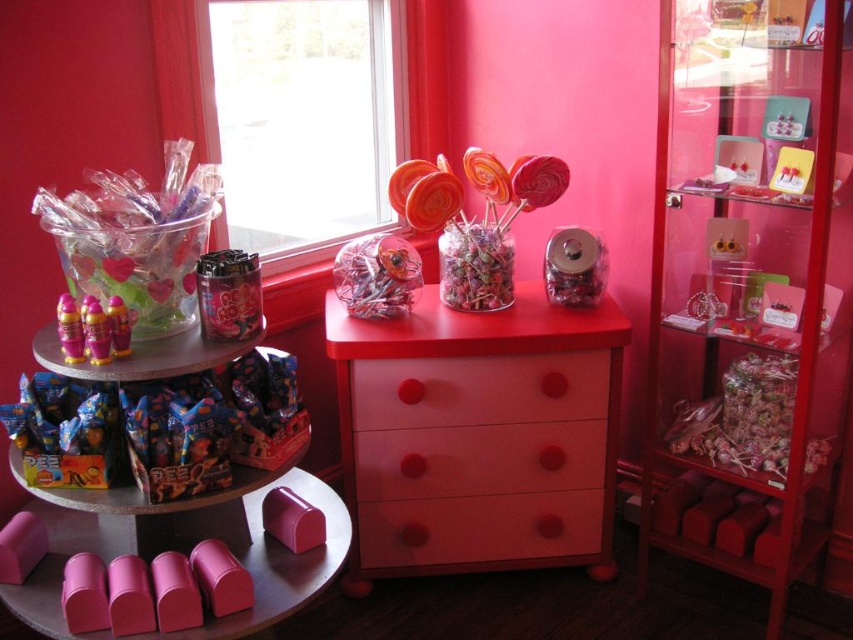
You are a customer in the candy shop and want to place your bag on the pink matte table at lower center. Based on the coordinates provided, can you determine if the table is positioned towards the right side of the scene?

The pink matte table at lower center is located at point 0.881 on the x axis and 0.329 on the y axis. Since the x coordinate is closer to 1, the table is positioned towards the right side of the scene.

You are a customer in the candy shop and want to pick up the shiny plastic lollipops at center. To reach them, you need to move around the pink matte table at lower center. Which direction should you move relative to the table to get to the lollipops?

Since the pink matte table at lower center is in front of the shiny plastic lollipops at center, you should move behind the table to reach the lollipops.